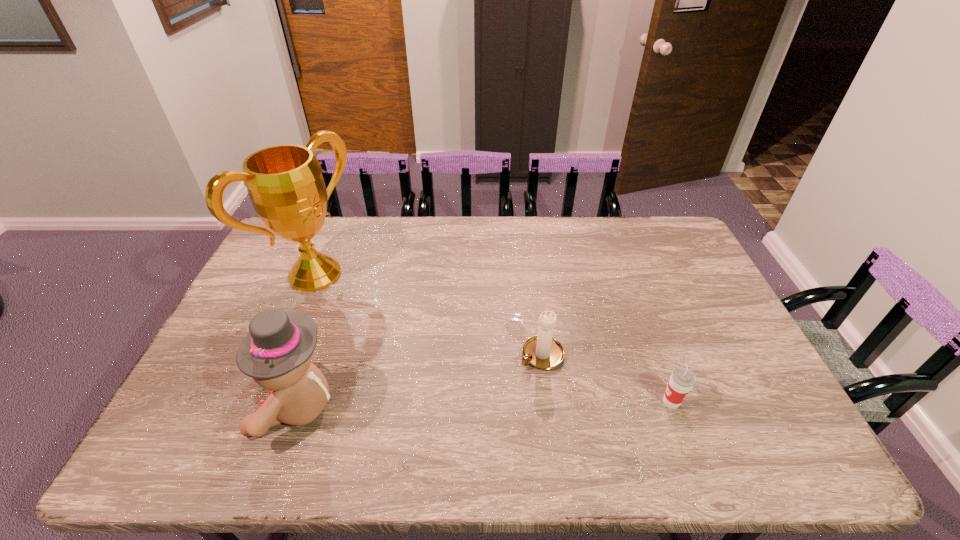
This screenshot has height=540, width=960. What are the coordinates of `vacant position in the image that satisfies the following two spatial constraints: 1. on the front side of the third shortest object; 2. on the front-facing side of the farthest object` in the screenshot? It's located at (260, 407).

Identify the location of free region that satisfies the following two spatial constraints: 1. on the front side of the award; 2. on the front-facing side of the third shortest object. This screenshot has width=960, height=540. (260, 407).